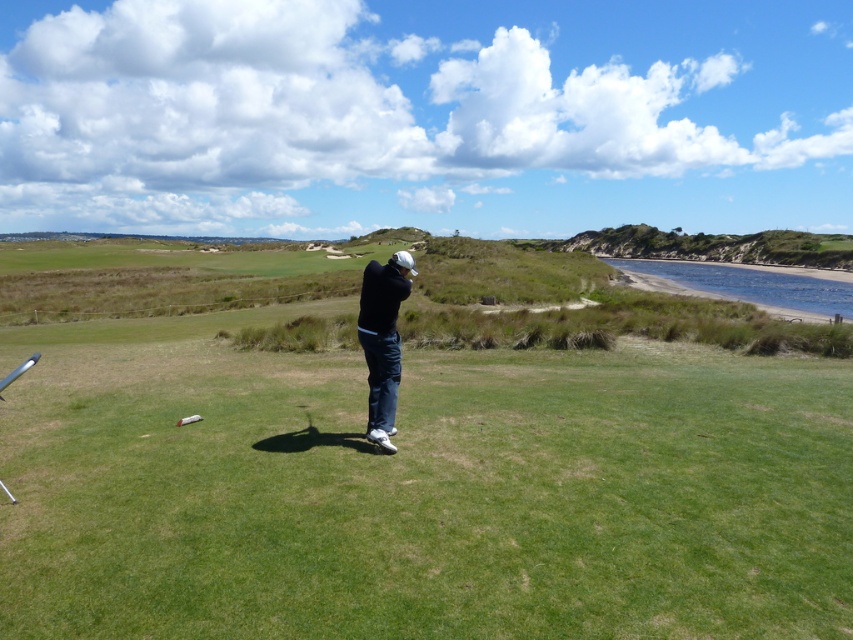
Question: Which point is closer to the camera?

Choices:
 (A) (376, 310)
 (B) (148, 387)

Answer: (A)

Question: Can you confirm if green grass at center is positioned to the right of black matte jacket at center?

Choices:
 (A) no
 (B) yes

Answer: (A)

Question: Can you confirm if green grass at center is thinner than black matte jacket at center?

Choices:
 (A) no
 (B) yes

Answer: (A)

Question: Which point is farther to the camera?

Choices:
 (A) black matte jacket at center
 (B) green grass at center

Answer: (A)

Question: Is green grass at center positioned behind black matte jacket at center?

Choices:
 (A) yes
 (B) no

Answer: (B)